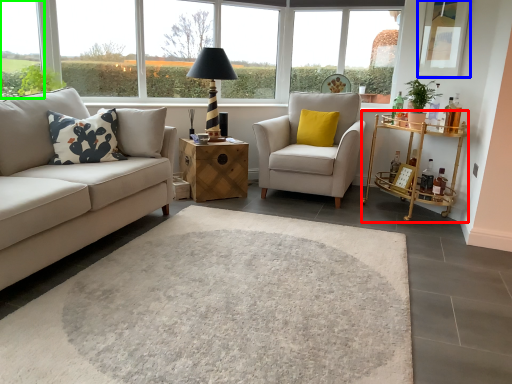
Question: Which object is positioned farthest from table (highlighted by a red box)? Select from window screen (highlighted by a blue box) and window (highlighted by a green box).

Choices:
 (A) window screen
 (B) window

Answer: (B)